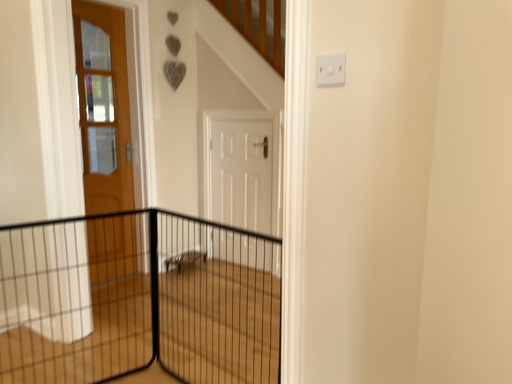
Question: Is white matte door at center, which is the 2th door from left to right, positioned with its back to black wire mesh at center?

Choices:
 (A) yes
 (B) no

Answer: (B)

Question: Is white matte door at center, which is the first door in right-to-left order, at the right side of black wire mesh at center?

Choices:
 (A) no
 (B) yes

Answer: (B)

Question: Is the surface of white matte door at center, which is the first door in right-to-left order, in direct contact with black wire mesh at center?

Choices:
 (A) no
 (B) yes

Answer: (A)

Question: Would you say white matte door at center, which is the first door in right-to-left order, contains black wire mesh at center?

Choices:
 (A) yes
 (B) no

Answer: (B)

Question: Is white matte door at center, which is the 2th door from left to right, not near black wire mesh at center?

Choices:
 (A) no
 (B) yes

Answer: (A)

Question: Can we say white matte door at center, which is the first door in right-to-left order, lies outside black wire mesh at center?

Choices:
 (A) yes
 (B) no

Answer: (A)

Question: Can black wire mesh at center be found inside white plastic electric outlet at upper right?

Choices:
 (A) no
 (B) yes

Answer: (A)

Question: Is white plastic electric outlet at upper right wider than black wire mesh at center?

Choices:
 (A) yes
 (B) no

Answer: (B)

Question: Does white plastic electric outlet at upper right appear on the left side of black wire mesh at center?

Choices:
 (A) no
 (B) yes

Answer: (A)

Question: Does white plastic electric outlet at upper right have a larger size compared to black wire mesh at center?

Choices:
 (A) no
 (B) yes

Answer: (A)

Question: Does white plastic electric outlet at upper right have a greater height compared to black wire mesh at center?

Choices:
 (A) no
 (B) yes

Answer: (A)

Question: Is white plastic electric outlet at upper right oriented away from black wire mesh at center?

Choices:
 (A) yes
 (B) no

Answer: (B)

Question: From the image's perspective, is matte wooden door at left, arranged as the second door when viewed from the right, above black wire mesh at center?

Choices:
 (A) yes
 (B) no

Answer: (A)